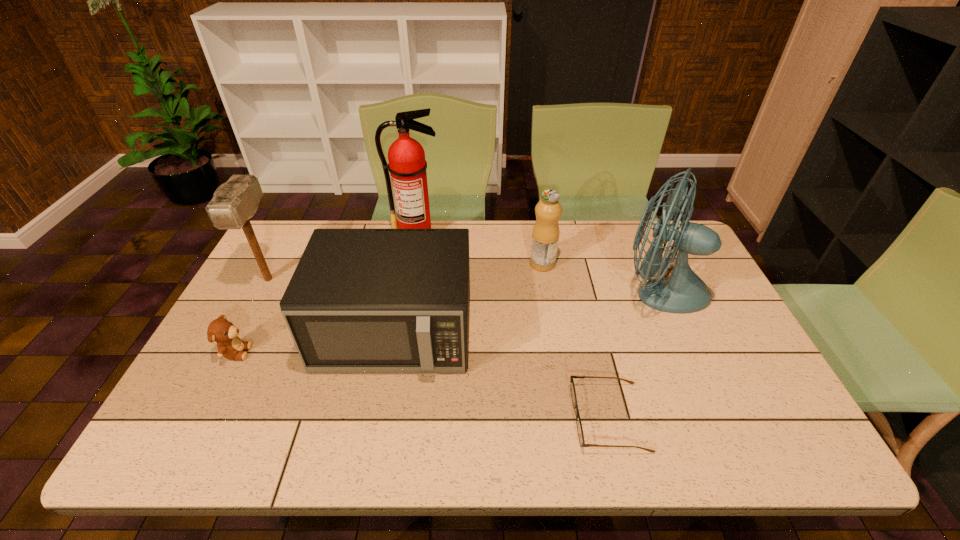
The width and height of the screenshot is (960, 540). I want to click on the farthest object, so 407,165.

Image resolution: width=960 pixels, height=540 pixels. I want to click on fan, so click(x=683, y=292).

Find the location of `the third tallest object`. the third tallest object is located at coordinates (236, 201).

Where is `fruit juice`? The width and height of the screenshot is (960, 540). fruit juice is located at coordinates (545, 236).

I want to click on microwave oven, so click(x=360, y=300).

This screenshot has width=960, height=540. I want to click on the sixth tallest object, so click(x=220, y=330).

Identify the location of the shortest object. This screenshot has height=540, width=960. (572, 387).

Locate an element on the screen. the nearest object is located at coordinates (572, 387).

The width and height of the screenshot is (960, 540). I want to click on vacant space located on the side of the fire extinguisher near the handle, so click(x=405, y=293).

Where is `free space located in front of the fan to blow air`? The image size is (960, 540). free space located in front of the fan to blow air is located at coordinates (530, 291).